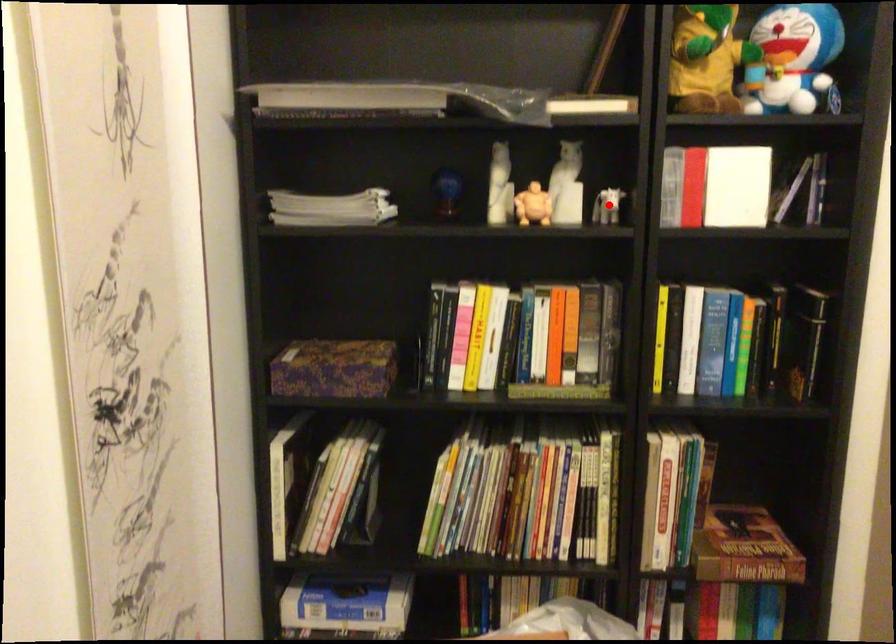
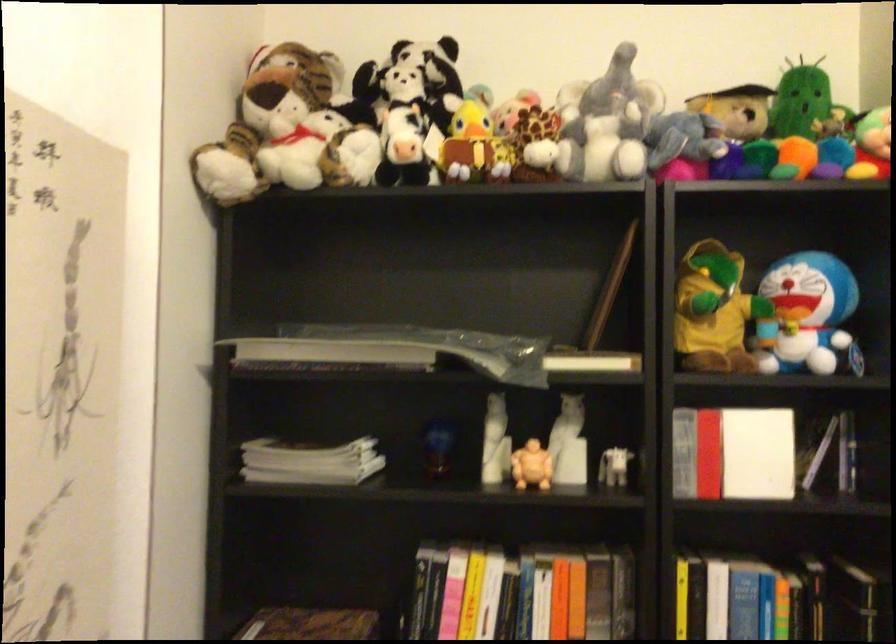
Question: I am providing you with two images of the same scene from different viewpoints. A red point is marked on the first image. Can you still see the location of the red point in image 2?

Choices:
 (A) Yes
 (B) No

Answer: (A)